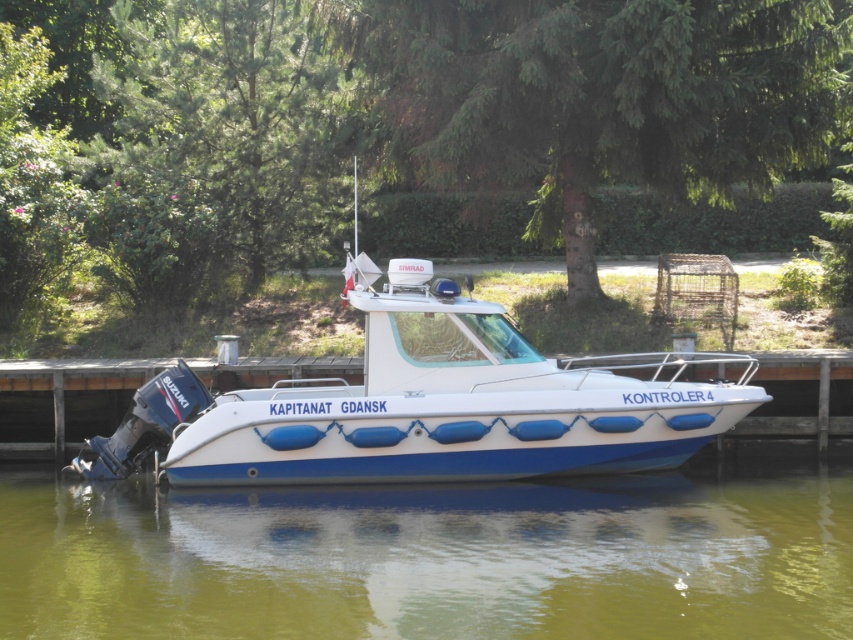
Question: Is greenish water at lower center bigger than white glossy boat at center?

Choices:
 (A) yes
 (B) no

Answer: (B)

Question: Observing the image, what is the correct spatial positioning of greenish water at lower center in reference to white wood dock at center?

Choices:
 (A) left
 (B) right

Answer: (B)

Question: Among these points, which one is farthest from the camera?

Choices:
 (A) (421, 292)
 (B) (96, 419)
 (C) (131, 577)

Answer: (B)

Question: Which point is farther from the camera taking this photo?

Choices:
 (A) (44, 436)
 (B) (42, 600)
 (C) (413, 474)

Answer: (A)

Question: Which object is closer to the camera taking this photo?

Choices:
 (A) white wood dock at center
 (B) greenish water at lower center
 (C) white glossy boat at center

Answer: (B)

Question: Can you confirm if white glossy boat at center is positioned below white wood dock at center?

Choices:
 (A) no
 (B) yes

Answer: (A)